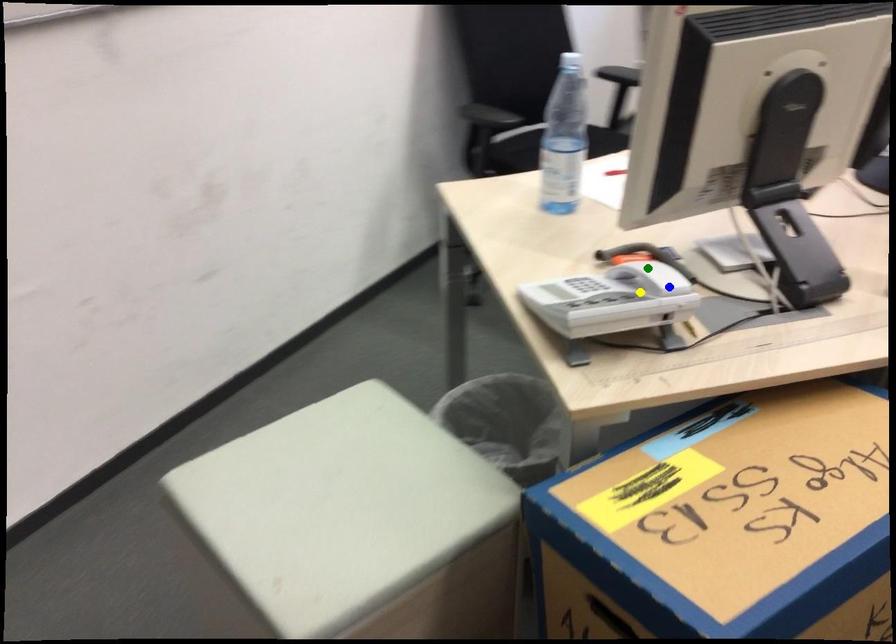
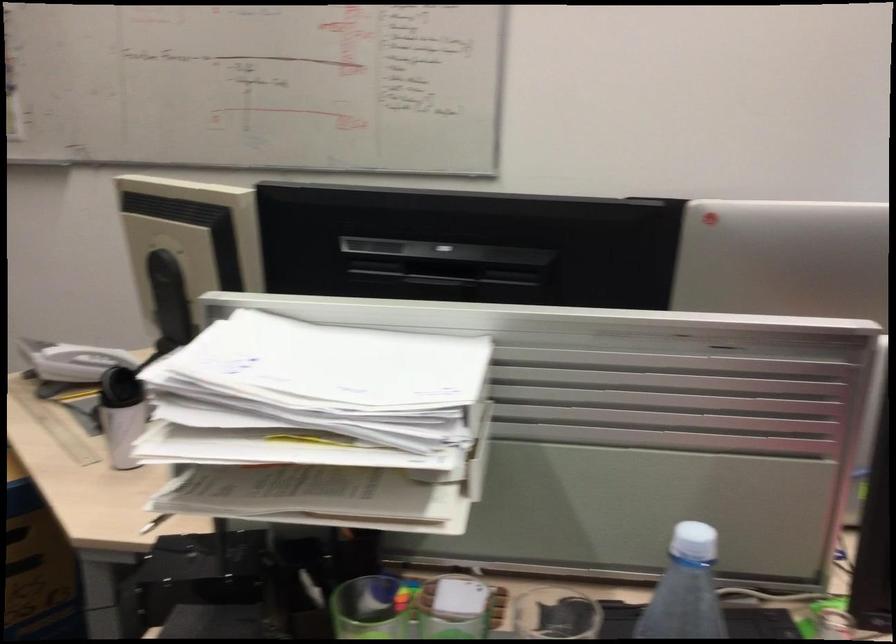
I am providing you with two images of the same scene from different viewpoints. Three points are marked in image1. Which point corresponds to a part or object that is occluded in image2?In image1, three points are marked. Which of them correspond to a part or object that is occluded in image2?Among the three points shown in image1, which one corresponds to a part or object that is no longer visible due to occlusion in image2?

green point